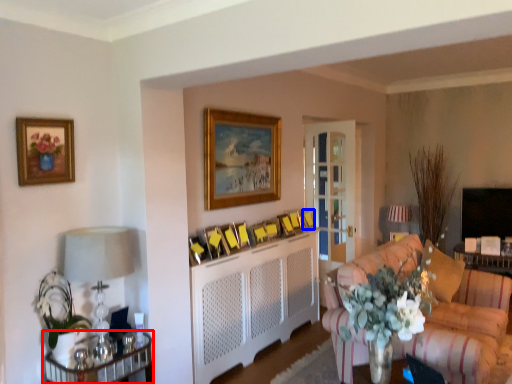
Question: Among these objects, which one is nearest to the camera, table (highlighted by a red box) or picture frame (highlighted by a blue box)?

Choices:
 (A) table
 (B) picture frame

Answer: (A)